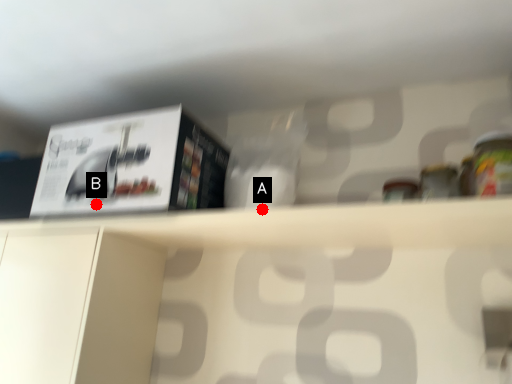
Question: Two points are circled on the image, labeled by A and B beside each circle. Among these points, which one is nearest to the camera?

Choices:
 (A) A is closer
 (B) B is closer

Answer: (B)